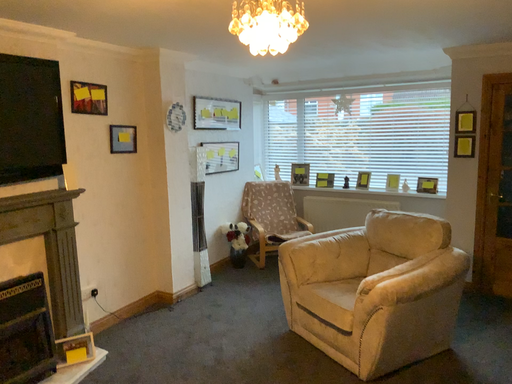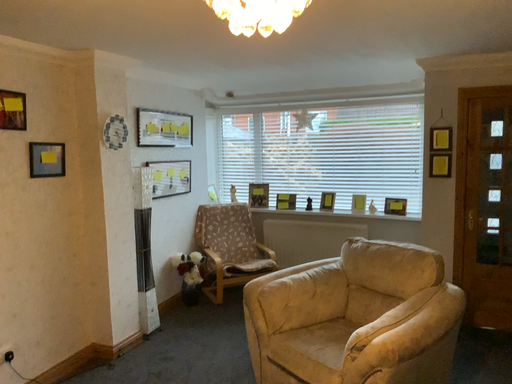
Question: Which way did the camera rotate in the video?

Choices:
 (A) rotated right
 (B) rotated left

Answer: (A)